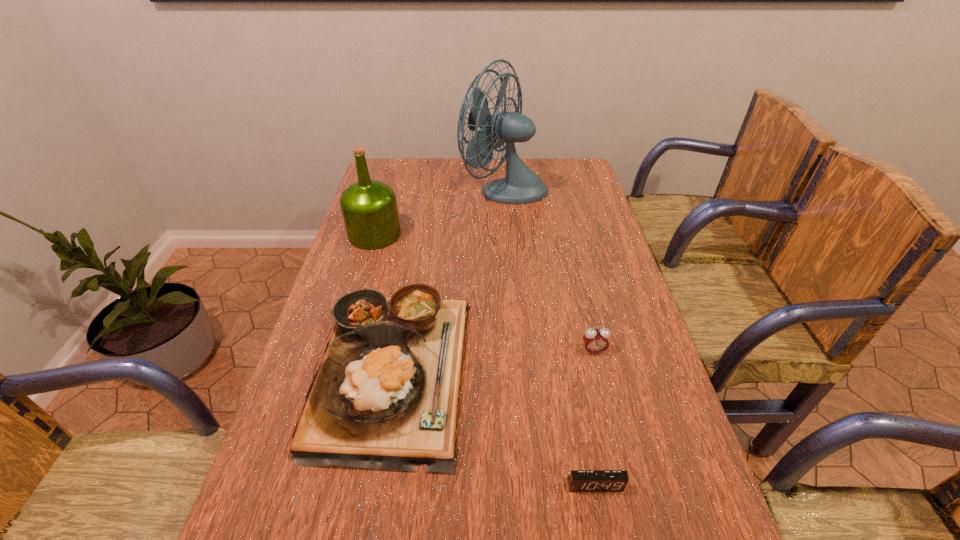
Where is `the tallest object`? The width and height of the screenshot is (960, 540). the tallest object is located at coordinates (521, 185).

You are a GUI agent. You are given a task and a screenshot of the screen. Output one action in this format:
    pyautogui.click(x=<x>, y=<y>)
    Task: Click on the farthest object
    
    Given the screenshot: What is the action you would take?
    pyautogui.click(x=521, y=185)

Where is `the second tallest object`? This screenshot has width=960, height=540. the second tallest object is located at coordinates (369, 208).

Image resolution: width=960 pixels, height=540 pixels. Find the location of `the fourth nearest object`. the fourth nearest object is located at coordinates (x=369, y=208).

At what (x,y) coordinates should I click in order to perform the action: click on platter. Please return your answer as a coordinate pair (x, y). Image resolution: width=960 pixels, height=540 pixels. Looking at the image, I should click on (385, 396).

The height and width of the screenshot is (540, 960). Identify the location of the taller alarm clock. (595, 340).

The image size is (960, 540). What are the coordinates of `the shortest object` in the screenshot? It's located at (579, 480).

What are the coordinates of `the nearest object` in the screenshot? It's located at (579, 480).

Identify the location of free space located 0.180m in front of the tallest object to blow air. (412, 188).

Find the location of a particular element. vacant space situated in front of the tallest object to blow air is located at coordinates (393, 188).